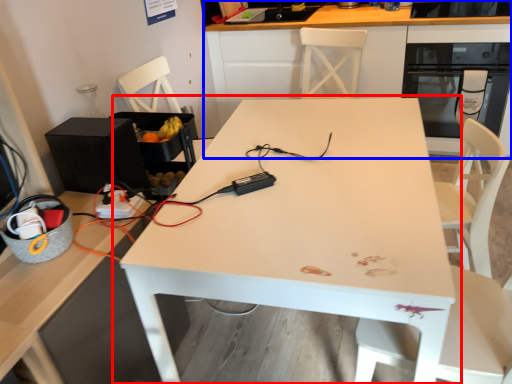
Question: Among these objects, which one is farthest to the camera, table (highlighted by a red box) or cabinetry (highlighted by a blue box)?

Choices:
 (A) table
 (B) cabinetry

Answer: (B)